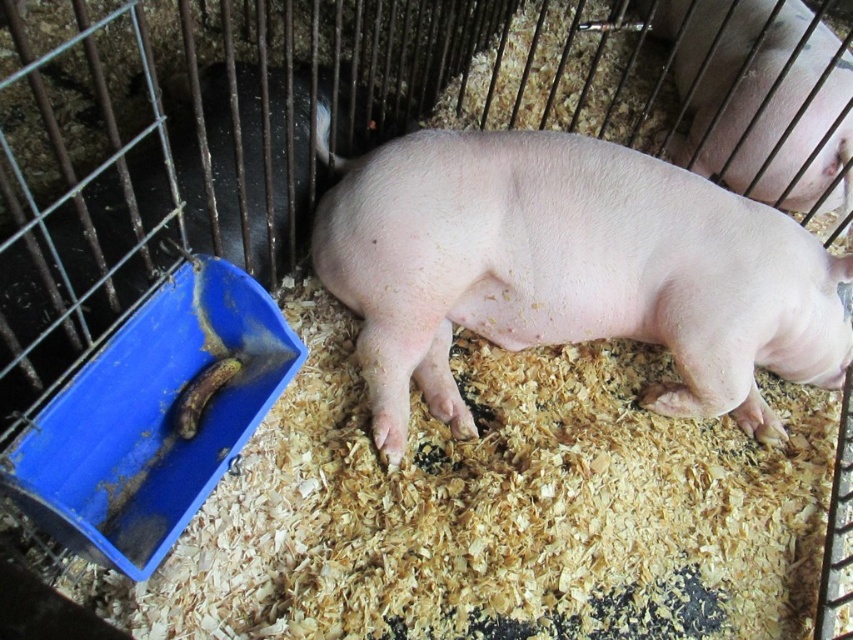
Question: Which point is farther to the camera?

Choices:
 (A) pink smooth pig at center
 (B) pink smooth skin at center

Answer: (B)

Question: Which of the following is the closest to the observer?

Choices:
 (A) pink smooth skin at center
 (B) pink smooth pig at center

Answer: (B)

Question: Which point is farther to the camera?

Choices:
 (A) pink smooth pig at center
 (B) pink smooth skin at center

Answer: (B)

Question: Is pink smooth pig at center further to camera compared to pink smooth skin at center?

Choices:
 (A) no
 (B) yes

Answer: (A)

Question: Does pink smooth pig at center appear on the right side of pink smooth skin at center?

Choices:
 (A) no
 (B) yes

Answer: (A)

Question: Does pink smooth pig at center have a greater width compared to pink smooth skin at center?

Choices:
 (A) yes
 (B) no

Answer: (A)